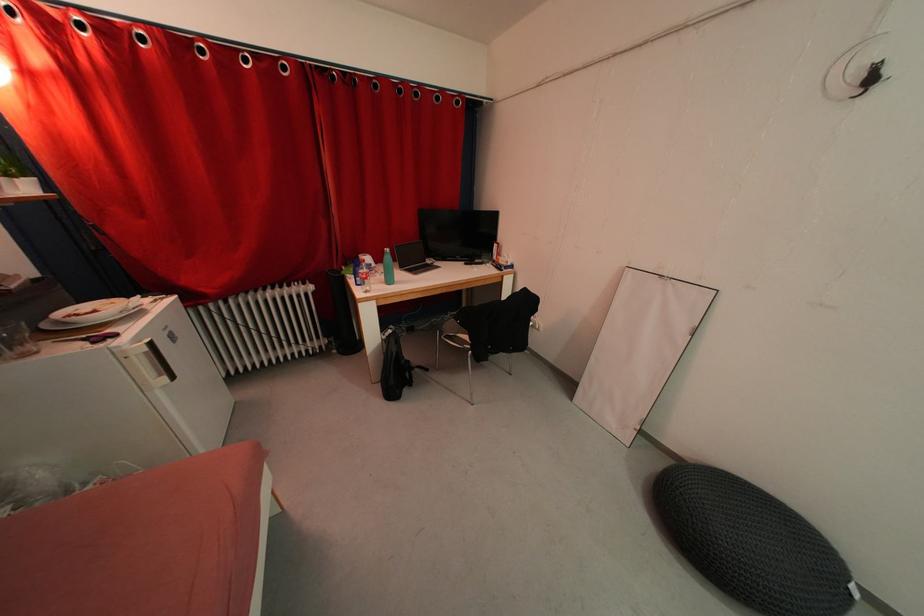
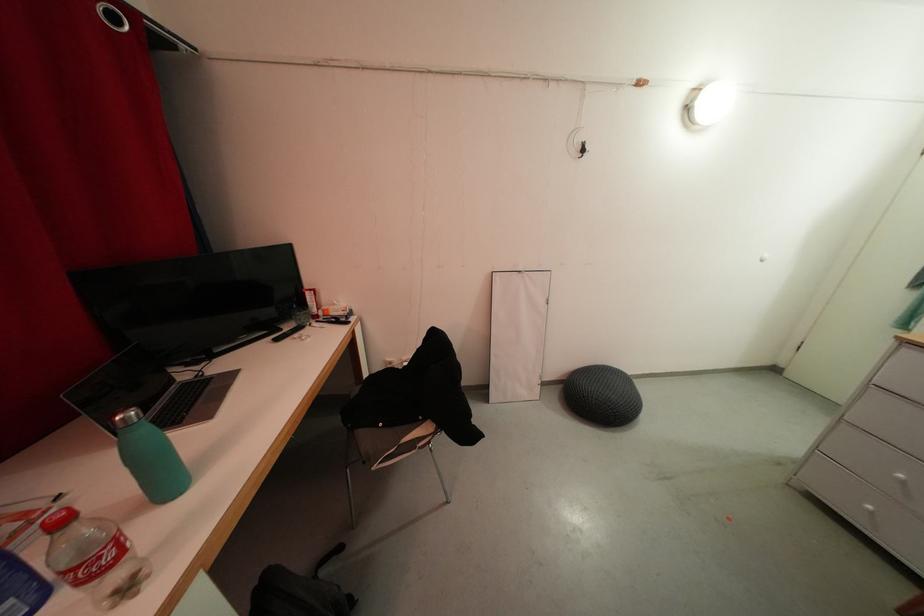
Find the pixel in the second image that matches point (482, 265) in the first image.

(293, 331)